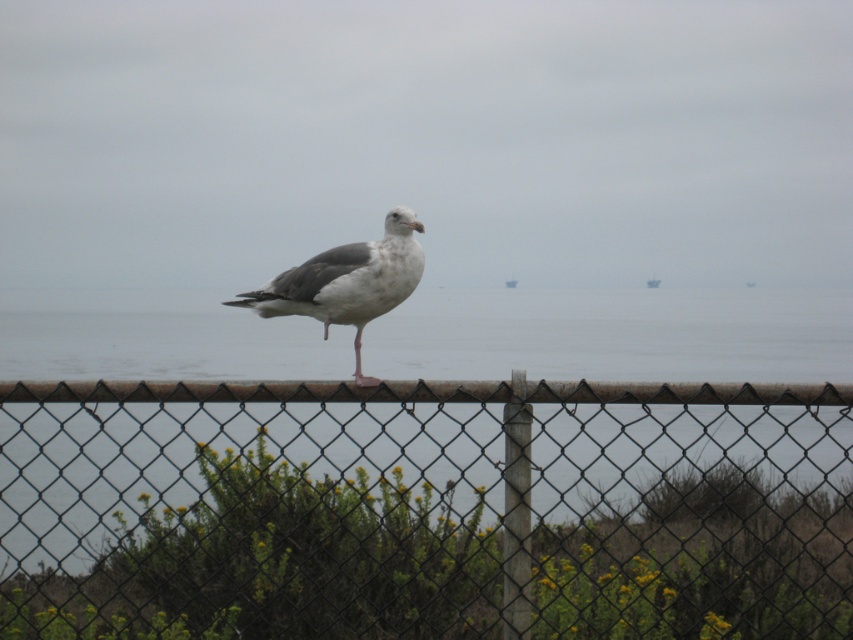
Can you confirm if chain-link fence at center is wider than white matte bird at center?

Yes.

Is point (67, 573) behind point (386, 216)?

Yes, point (67, 573) is behind point (386, 216).

Between point (370, 547) and point (325, 310), which one is positioned in front?

Point (325, 310) is more forward.

The width and height of the screenshot is (853, 640). I want to click on chain-link fence at center, so click(x=425, y=509).